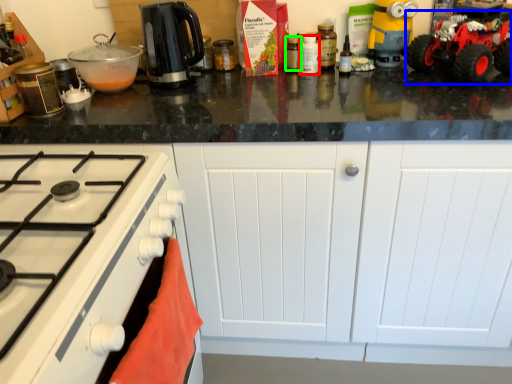
Question: Which is nearer to the kitchen appliance (highlighted by a red box)? toy car (highlighted by a blue box) or kitchen appliance (highlighted by a green box).

Choices:
 (A) toy car
 (B) kitchen appliance

Answer: (B)